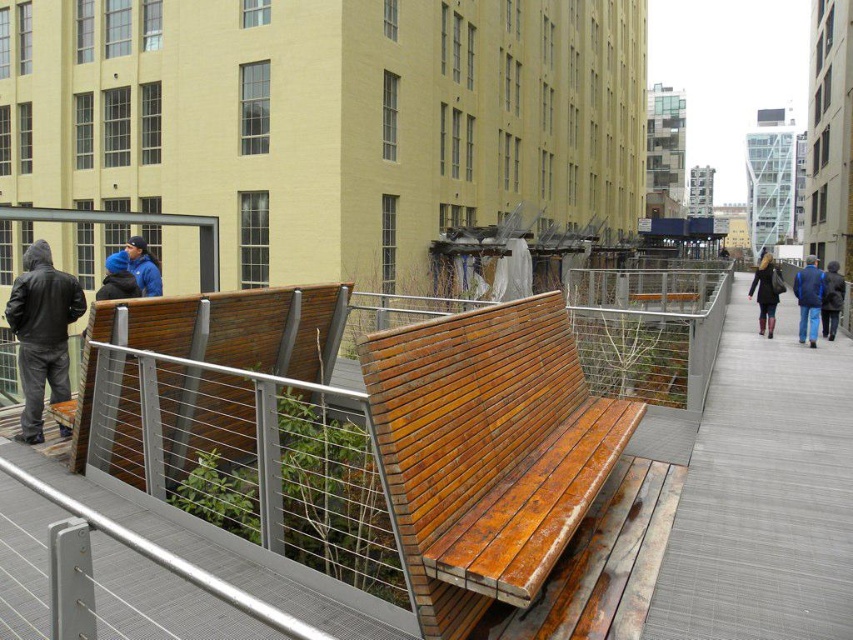
Is point (799, 269) closer to viewer compared to point (140, 266)?

No, (799, 269) is behind (140, 266).

Is blue denim jacket at lower right bigger than matte blue jacket at left?

Correct, blue denim jacket at lower right is larger in size than matte blue jacket at left.

Which is behind, point (799, 280) or point (157, 292)?

Positioned behind is point (799, 280).

You are a GUI agent. You are given a task and a screenshot of the screen. Output one action in this format:
    pyautogui.click(x=<x>, y=<y>)
    Task: Click on the blue denim jacket at lower right
    
    Given the screenshot: What is the action you would take?
    pyautogui.click(x=808, y=300)

Can you confirm if gray textured pavement at center is thinner than dark gray hoodie at left?

Incorrect, gray textured pavement at center's width is not less than dark gray hoodie at left's.

How much distance is there between gray textured pavement at center and dark gray hoodie at left?

They are 9.59 meters apart.

What do you see at coordinates (764, 493) in the screenshot?
I see `gray textured pavement at center` at bounding box center [764, 493].

Locate an element on the screen. This screenshot has width=853, height=640. gray textured pavement at center is located at coordinates (764, 493).

Is blue denim jacket at lower right taller than dark brown leather jacket at right?

Yes.

Does blue denim jacket at lower right have a lesser height compared to dark brown leather jacket at right?

Incorrect, blue denim jacket at lower right's height does not fall short of dark brown leather jacket at right's.

Is point (814, 266) behind point (827, 326)?

No, (814, 266) is in front of (827, 326).

Identify the location of blue denim jacket at lower right. (808, 300).